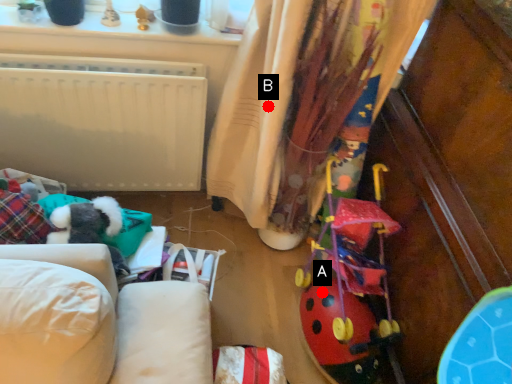
Question: Two points are circled on the image, labeled by A and B beside each circle. Which point is farther to the camera?

Choices:
 (A) A is further
 (B) B is further

Answer: (A)